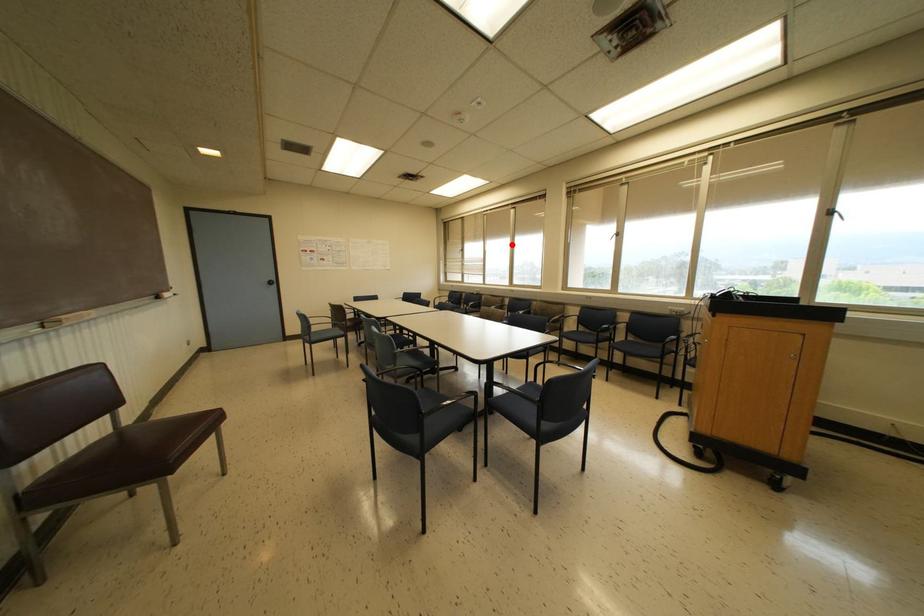
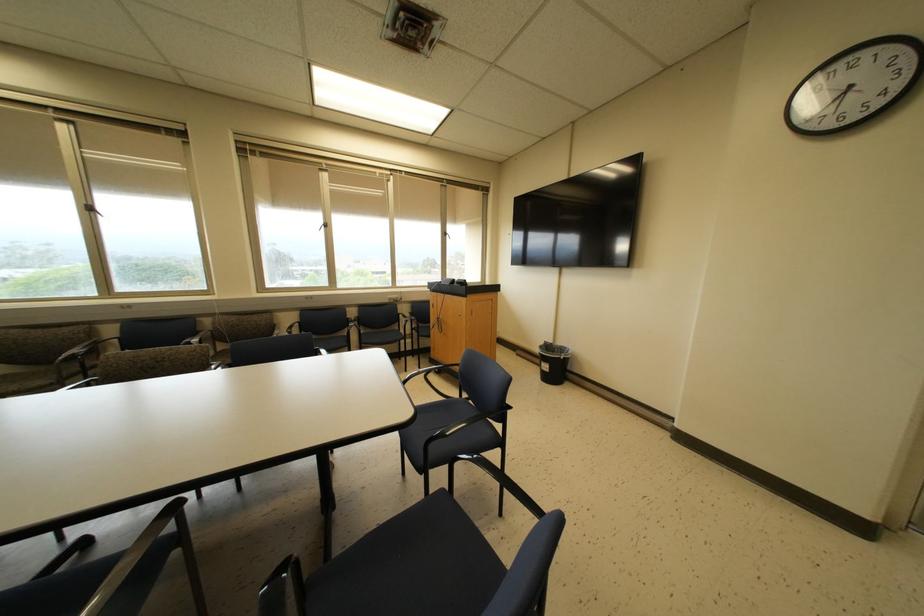
Where in the second image is the point corresponding to the highlighted location from the first image?

(89, 208)